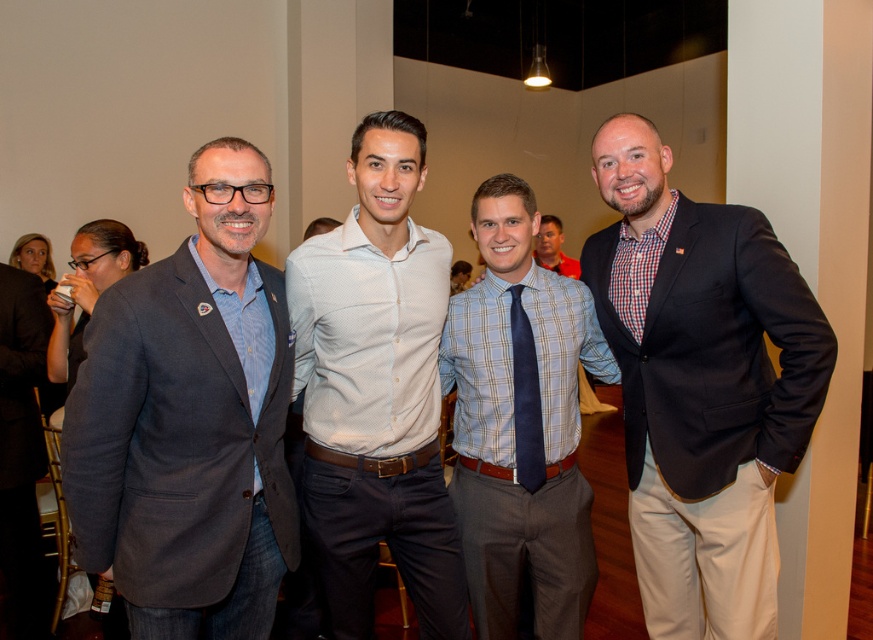
You are a photographer at a formal event. You need to adjust the lighting to ensure both the white textured shirt at center and the navy satin tie at center are well lit. Given their sizes, which one might require more focused lighting adjustments?

The white textured shirt at center is much taller than the navy satin tie at center, so it might require more focused lighting adjustments due to its larger size.